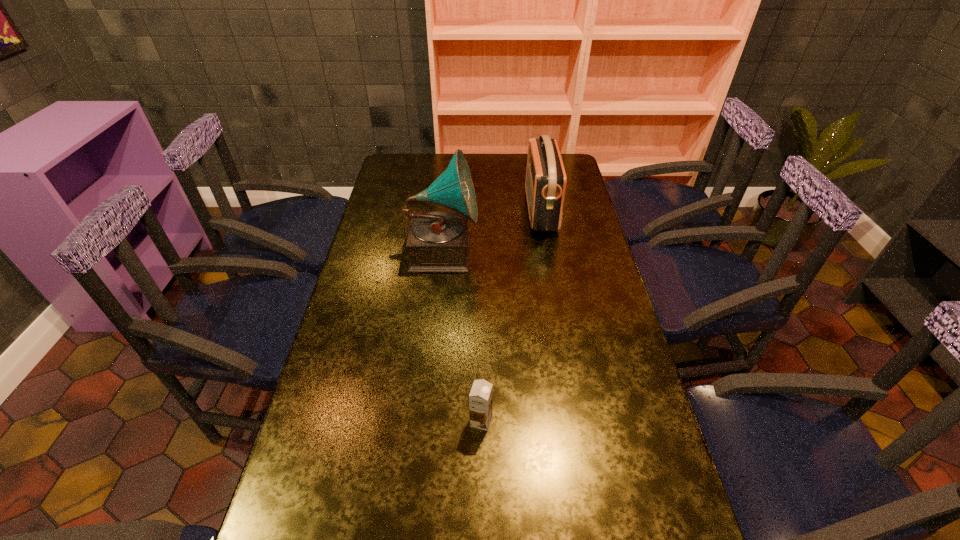
You are a GUI agent. You are given a task and a screenshot of the screen. Output one action in this format:
    pyautogui.click(x=<x>, y=<y>)
    Task: Click on the tallest object
    
    Given the screenshot: What is the action you would take?
    click(438, 241)

Image resolution: width=960 pixels, height=540 pixels. What are the coordinates of `the rightmost object` in the screenshot? It's located at (545, 184).

The image size is (960, 540). What are the coordinates of `the second tallest object` in the screenshot? It's located at (545, 184).

Where is `the nearest object`? The image size is (960, 540). the nearest object is located at coordinates (480, 398).

The width and height of the screenshot is (960, 540). I want to click on the shortest object, so click(480, 398).

Locate an element on the screen. vacant space located 0.290m on the horn of the record player is located at coordinates (562, 251).

Locate an element on the screen. Image resolution: width=960 pixels, height=540 pixels. free space located 0.280m on the front-facing side of the radio receiver is located at coordinates (455, 211).

At what (x,y) coordinates should I click in order to perform the action: click on blank area located on the front-facing side of the radio receiver. Please return your answer as a coordinate pair (x, y). This screenshot has width=960, height=540. Looking at the image, I should click on (492, 211).

Image resolution: width=960 pixels, height=540 pixels. Identify the location of vacant space located 0.160m on the front-facing side of the radio receiver. (486, 211).

Image resolution: width=960 pixels, height=540 pixels. In order to click on vacant space located on the front of the nearest object in this screenshot , I will do `click(481, 488)`.